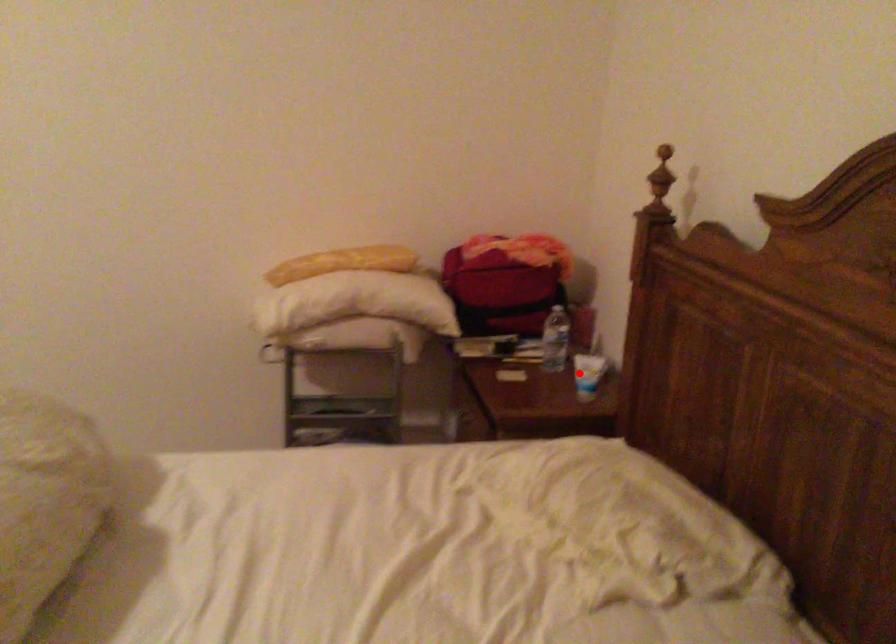
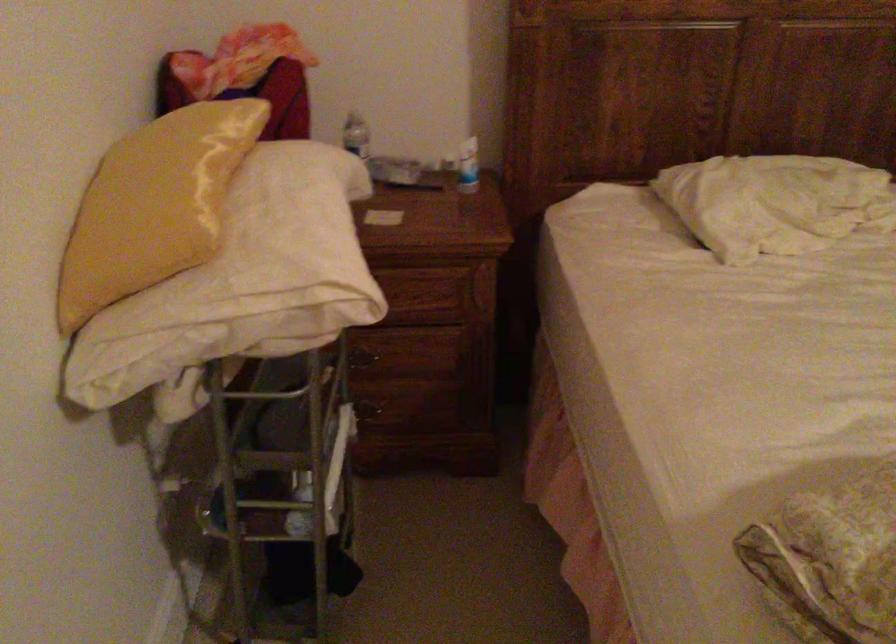
Question: A red point is marked in image1. In image2, is the corresponding 3D point closer to the camera or farther? Reply with the corresponding letter.

Choices:
 (A) The corresponding 3D point is closer.
 (B) The corresponding 3D point is farther.

Answer: (A)